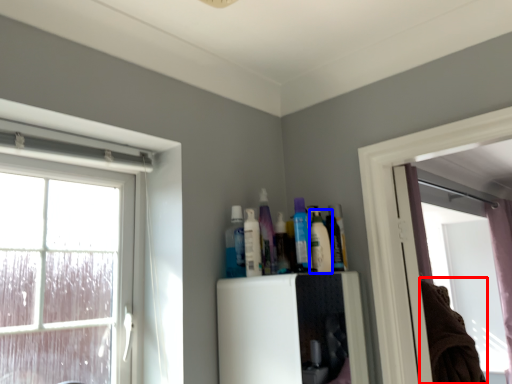
Question: Which object is further to the camera taking this photo, laundry (highlighted by a red box) or toiletry (highlighted by a blue box)?

Choices:
 (A) laundry
 (B) toiletry

Answer: (A)